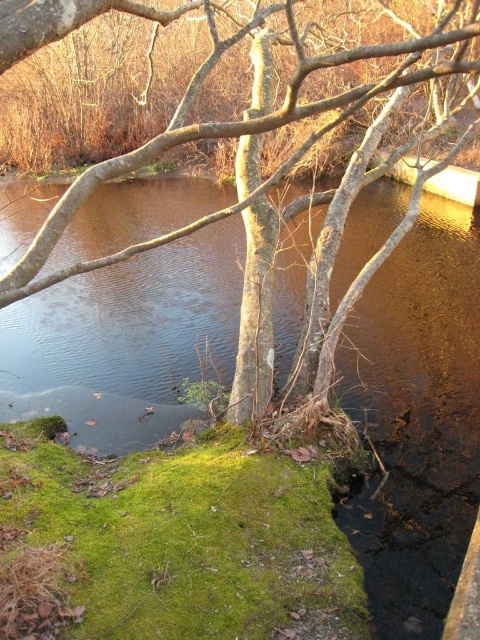
Based on the photo, you are standing at the point with coordinates point (224, 125) and want to walk towards the point with coordinates point (448, 364). Given the scene described, what might block your path?

Point (448, 364) is behind point (224, 125), so the path might be blocked by the cluster of bare tree branches in the foreground.

You are an environmental scientist assessing the health of this water body. You observe the brown smooth water at center and the brown bark tree at center. Which of these two features occupies a greater area in the scene?

The brown smooth water at center has a larger size compared to the brown bark tree at center, so it occupies a greater area in the scene.